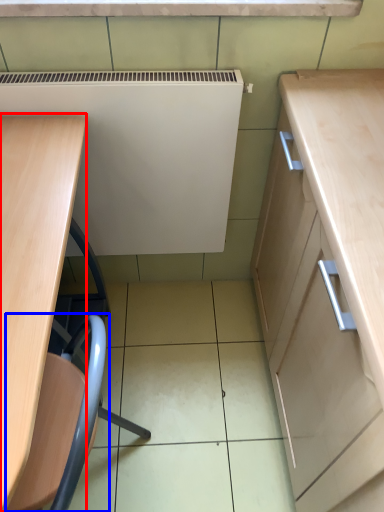
Question: Which point is closer to the camera, desk (highlighted by a red box) or swivel chair (highlighted by a blue box)?

Choices:
 (A) desk
 (B) swivel chair

Answer: (A)